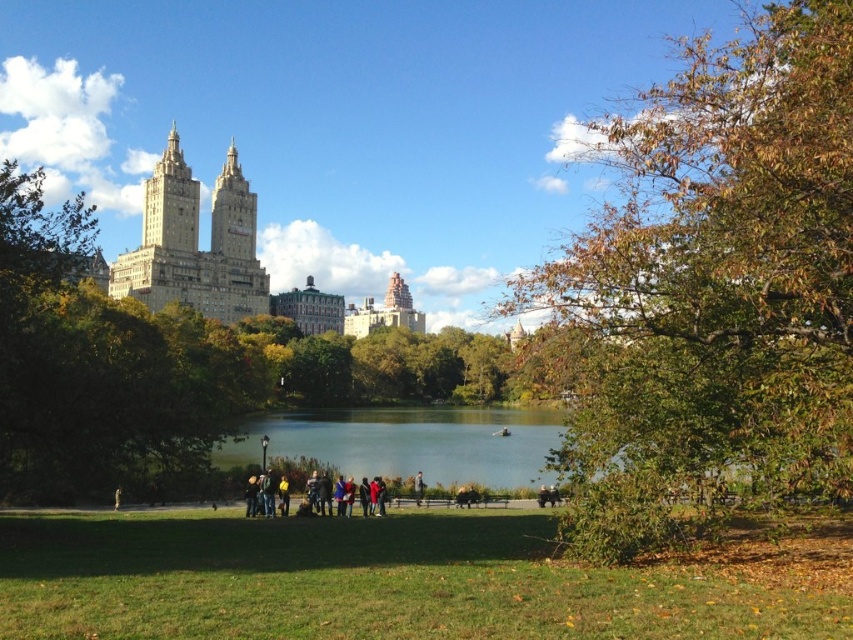
Question: Does green fabric jacket at lower center have a larger size compared to brown leather jacket at center?

Choices:
 (A) yes
 (B) no

Answer: (A)

Question: Which point is closer to the camera?

Choices:
 (A) clear blue water at center
 (B) green leafy tree at center
 (C) brown leather jacket at center
 (D) yellow fabric jacket at center

Answer: (B)

Question: Is green leafy tree at center in front of clear blue water at center?

Choices:
 (A) no
 (B) yes

Answer: (B)

Question: Which point is farther from the camera taking this photo?

Choices:
 (A) (480, 465)
 (B) (281, 476)

Answer: (A)

Question: Which point is farther to the camera?

Choices:
 (A) yellow fabric jacket at center
 (B) green leafy tree at center
 (C) brown leather jacket at center
 (D) green fabric jacket at lower center

Answer: (C)

Question: Does clear blue water at center appear over yellow fabric jacket at center?

Choices:
 (A) yes
 (B) no

Answer: (A)